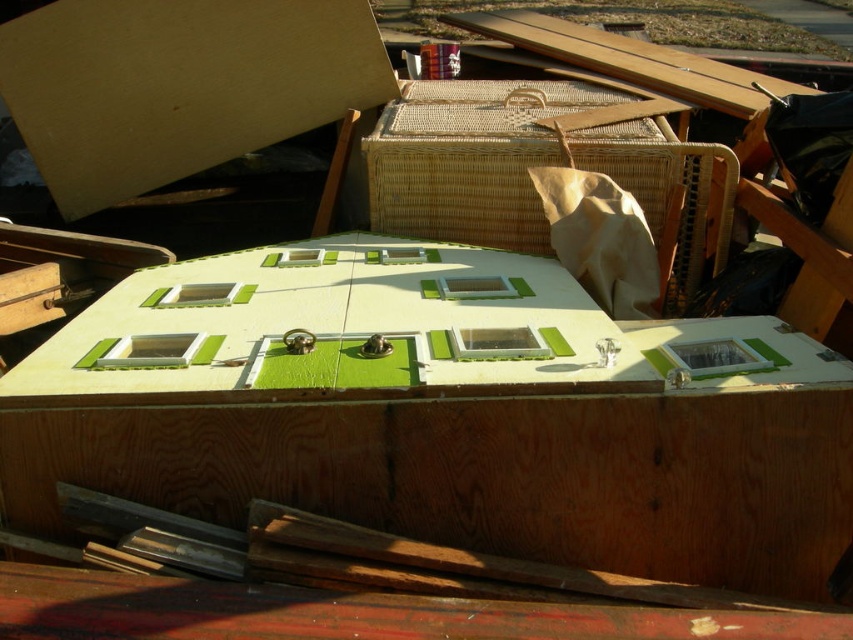
Who is shorter, matte cardboard at upper left or woven rattan crate at center?

matte cardboard at upper left is shorter.

Is matte cardboard at upper left in front of woven rattan crate at center?

That is False.

Where is `matte cardboard at upper left`? Image resolution: width=853 pixels, height=640 pixels. matte cardboard at upper left is located at coordinates (178, 84).

At what (x,y) coordinates should I click in order to perform the action: click on matte cardboard at upper left. Please return your answer as a coordinate pair (x, y). Looking at the image, I should click on (178, 84).